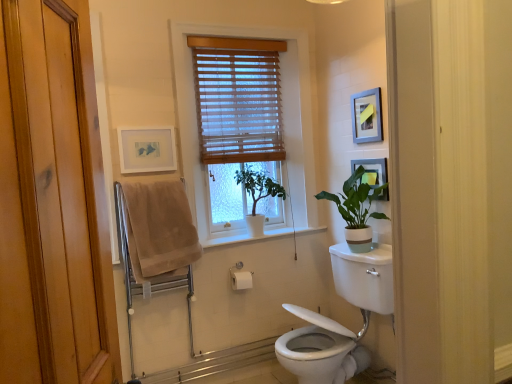
Identify the location of vacant point above wooden blinds at center (from a real-world perspective). (243, 41).